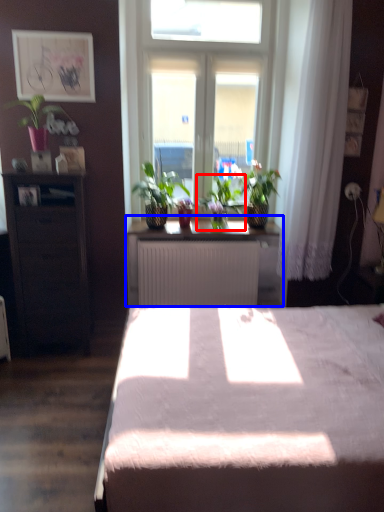
Question: Which object is further to the camera taking this photo, houseplant (highlighted by a red box) or table (highlighted by a blue box)?

Choices:
 (A) houseplant
 (B) table

Answer: (A)